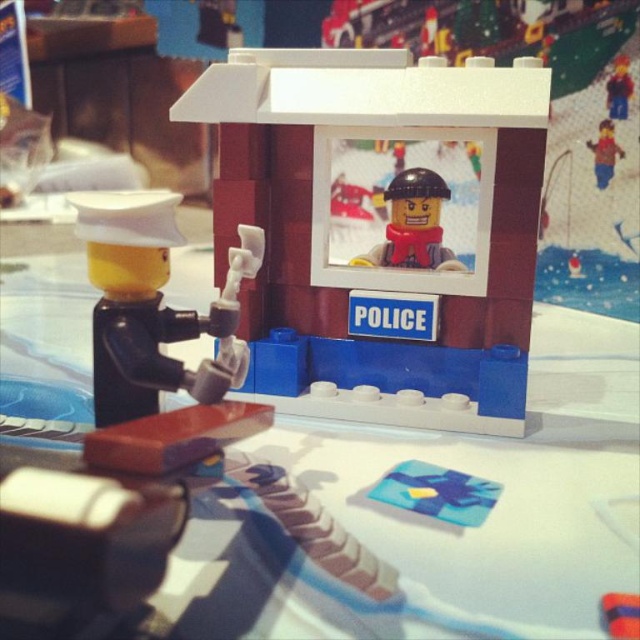
Can you confirm if matte plastic police booth at center is bigger than matte red minifigure at center?

Yes, matte plastic police booth at center is bigger than matte red minifigure at center.

Consider the image. Does matte plastic police booth at center come in front of matte red minifigure at center?

That is True.

Does point (502, 260) lie behind point (369, 262)?

No, it is not.

The height and width of the screenshot is (640, 640). Identify the location of matte plastic police booth at center. (381, 234).

Is matte plastic police booth at center further to camera compared to matte black minifigure at left?

That is True.

Measure the distance between matte plastic police booth at center and camera.

The distance of matte plastic police booth at center from camera is 31.63 inches.

This screenshot has width=640, height=640. What are the coordinates of `matte plastic police booth at center` in the screenshot? It's located at (381, 234).

Between matte red minifigure at center and smooth plastic minifigure at upper right, which one is positioned higher?

smooth plastic minifigure at upper right

Does matte red minifigure at center have a greater width compared to smooth plastic minifigure at upper right?

Indeed, matte red minifigure at center has a greater width compared to smooth plastic minifigure at upper right.

Measure the distance between point [419,214] and camera.

Point [419,214] is 3.71 feet from camera.

Identify the location of matte red minifigure at center. This screenshot has height=640, width=640. (413, 225).